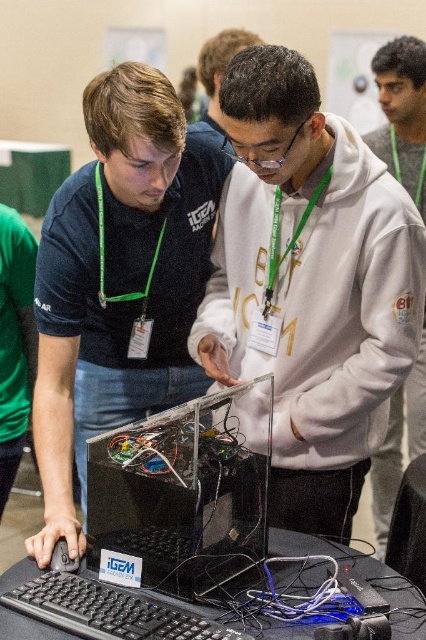
You are a judge at the event and need to determine if the transparent plastic computer at center can be placed on a shelf that requires items to be shorter than the matte black shirt at left. Can it be placed there?

The matte black shirt at left has a greater height compared to the transparent plastic computer at center. Since the shelf requires items to be shorter than the matte black shirt at left, the transparent plastic computer at center can be placed there as it is shorter.

You are attending a tech event and see a white matte hoodie at center. If you want to place a small electronic component from the transparent box onto the hoodie, will it fit without overlapping the box?

The white matte hoodie at center is located at point [310,285], which is separate from the transparent box. Therefore, placing the component on the hoodie should not overlap the box.

In the scene shown: You are attending a robotics competition and see two items on a table. There is a matte black shirt at left and a transparent plastic computer at center. From your perspective, which item is positioned more to the left?

The matte black shirt at left is positioned more to the left than the transparent plastic computer at center.